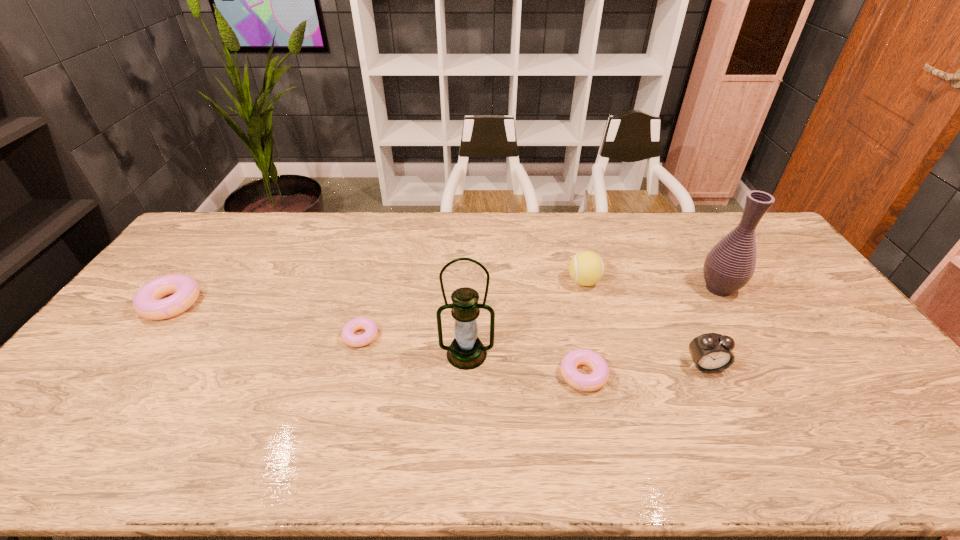
At what (x,y) coordinates should I click in order to perform the action: click on vacant region at the near edge. Please return your answer as a coordinate pair (x, y). The width and height of the screenshot is (960, 540). Looking at the image, I should click on (386, 415).

Find the location of a particular element. This screenshot has height=540, width=960. vacant region at the left edge is located at coordinates (127, 388).

I want to click on free space at the right edge, so click(775, 293).

The width and height of the screenshot is (960, 540). Identify the location of free region at the near left corner of the desktop. (111, 395).

You are a GUI agent. You are given a task and a screenshot of the screen. Output one action in this format:
    pyautogui.click(x=<x>, y=<y>)
    Task: Click on the free space between the second shortest doughnut and the leftmost object
    
    Given the screenshot: What is the action you would take?
    pyautogui.click(x=377, y=339)

Where is `free space between the sixth tallest object and the tennis ball`? The image size is (960, 540). free space between the sixth tallest object and the tennis ball is located at coordinates (584, 328).

At what (x,y) coordinates should I click in order to perform the action: click on vacant space that's between the rightmost doughnut and the third object from left to right. Please return your answer as a coordinate pair (x, y). Looking at the image, I should click on (525, 364).

Locate an element on the screen. This screenshot has height=540, width=960. vacant area that lies between the second object from left to right and the sixth object from left to right is located at coordinates (533, 351).

I want to click on free spot between the shortest doughnut and the fifth tallest object, so click(266, 320).

Identify the location of free point between the tennis ball and the vase. Image resolution: width=960 pixels, height=540 pixels. (651, 285).